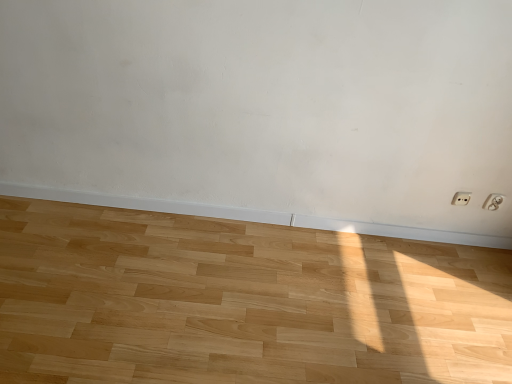
You are a GUI agent. You are given a task and a screenshot of the screen. Output one action in this format:
    pyautogui.click(x=<x>, y=<y>)
    Task: Click on the free space above natural wood floor at center (from a real-world perspective)
    
    Given the screenshot: What is the action you would take?
    pyautogui.click(x=243, y=290)